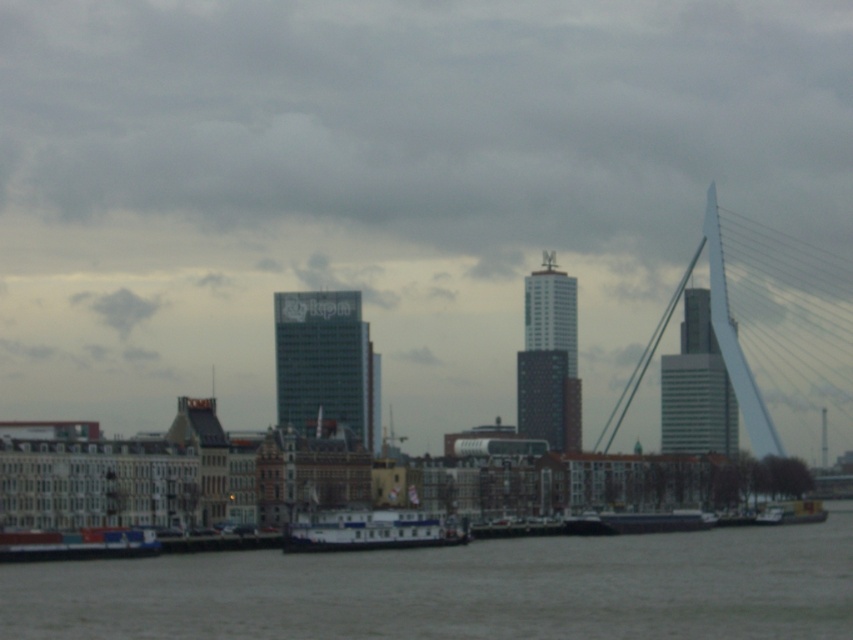
Question: Is transparent glass buildings at center closer to the viewer compared to white matte boat at lower center?

Choices:
 (A) no
 (B) yes

Answer: (A)

Question: Which object appears farthest from the camera in this image?

Choices:
 (A) transparent glass buildings at center
 (B) gray concrete water at lower center
 (C) white matte boat at lower center

Answer: (A)

Question: Is gray concrete water at lower center above white glass bridge at right?

Choices:
 (A) yes
 (B) no

Answer: (B)

Question: Estimate the real-world distances between objects in this image. Which object is closer to the gray concrete water at lower center?

Choices:
 (A) white matte boat at lower center
 (B) white glass bridge at right
 (C) transparent glass buildings at center

Answer: (A)

Question: Does white glass bridge at right have a larger size compared to white matte boat at lower center?

Choices:
 (A) no
 (B) yes

Answer: (B)

Question: Which point is farther to the camera?

Choices:
 (A) (x=764, y=161)
 (B) (x=839, y=326)
 (C) (x=341, y=547)

Answer: (A)